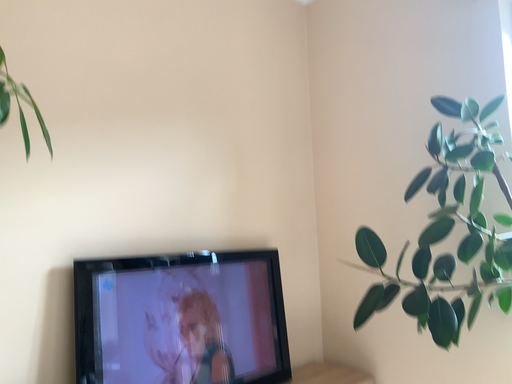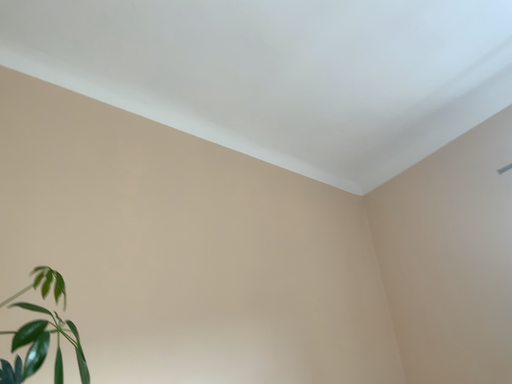
Question: How did the camera likely rotate when shooting the video?

Choices:
 (A) rotated upward
 (B) rotated downward

Answer: (A)